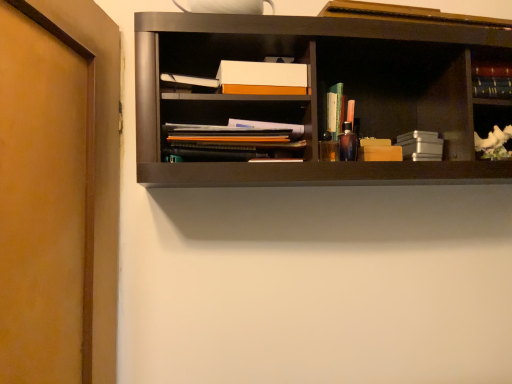
Question: Would you say hardcover book at upper right, which appears as the first book when viewed from the right, is outside white porcelain vase at right?

Choices:
 (A) yes
 (B) no

Answer: (A)

Question: Is hardcover book at upper right, which appears as the first book when viewed from the right, behind white porcelain vase at right?

Choices:
 (A) no
 (B) yes

Answer: (B)

Question: From a real-world perspective, does hardcover book at upper right, which appears as the fourth book when viewed from the left, sit lower than white porcelain vase at right?

Choices:
 (A) yes
 (B) no

Answer: (B)

Question: Considering the relative sizes of hardcover book at upper right, which appears as the first book when viewed from the right, and white porcelain vase at right in the image provided, is hardcover book at upper right, which appears as the first book when viewed from the right, thinner than white porcelain vase at right?

Choices:
 (A) no
 (B) yes

Answer: (B)

Question: From the image's perspective, is hardcover book at upper right, which appears as the first book when viewed from the right, over white porcelain vase at right?

Choices:
 (A) yes
 (B) no

Answer: (A)

Question: From the image's perspective, is white porcelain vase at right located above or below translucent plastic pen holder at center, the second book positioned from the left?

Choices:
 (A) above
 (B) below

Answer: (B)

Question: In terms of height, does white porcelain vase at right look taller or shorter compared to translucent plastic pen holder at center, the second book positioned from the left?

Choices:
 (A) short
 (B) tall

Answer: (A)

Question: Relative to translucent plastic pen holder at center, the second book positioned from the left, is white porcelain vase at right in front or behind?

Choices:
 (A) behind
 (B) front

Answer: (B)

Question: In the image, is white porcelain vase at right on the left side or the right side of translucent plastic pen holder at center, the second book positioned from the left?

Choices:
 (A) left
 (B) right

Answer: (B)

Question: From the image's perspective, relative to brown matte door at left, is matte black notebook at center, which is counted as the 1th book, starting from the left, above or below?

Choices:
 (A) above
 (B) below

Answer: (A)

Question: In terms of size, does matte black notebook at center, the fourth book in the right-to-left sequence, appear bigger or smaller than brown matte door at left?

Choices:
 (A) big
 (B) small

Answer: (B)

Question: Is matte black notebook at center, the fourth book in the right-to-left sequence, wider or thinner than brown matte door at left?

Choices:
 (A) thin
 (B) wide

Answer: (A)

Question: Is matte black notebook at center, the fourth book in the right-to-left sequence, to the left or to the right of brown matte door at left in the image?

Choices:
 (A) right
 (B) left

Answer: (A)

Question: Does point (205, 153) appear closer or farther from the camera than point (331, 89)?

Choices:
 (A) farther
 (B) closer

Answer: (B)

Question: Considering the positions of matte black notebook at center, the fourth book in the right-to-left sequence, and translucent plastic pen holder at center, which appears as the 3th book when viewed from the right, in the image, is matte black notebook at center, the fourth book in the right-to-left sequence, bigger or smaller than translucent plastic pen holder at center, which appears as the 3th book when viewed from the right,?

Choices:
 (A) small
 (B) big

Answer: (B)